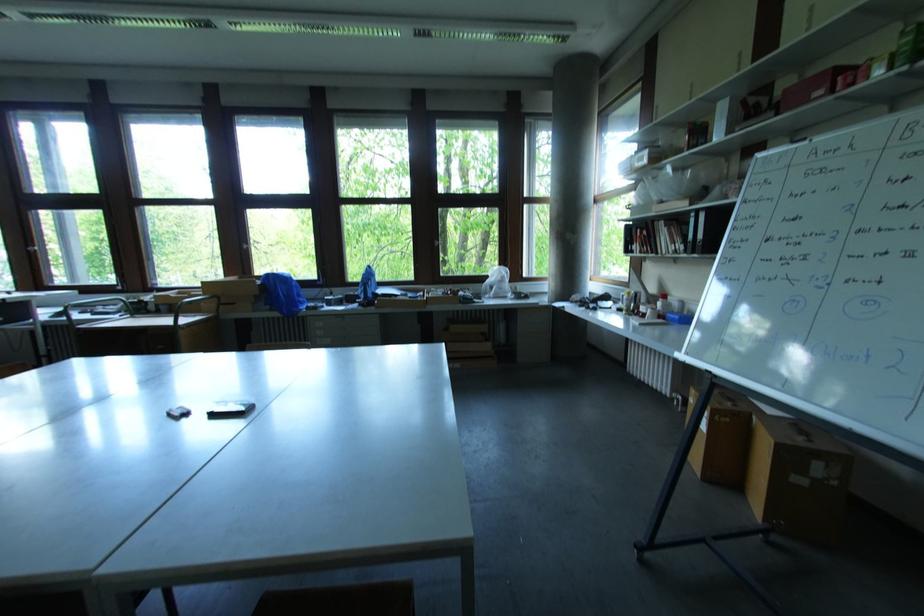
Where would you squeez the white spray bottle? Please return your answer as a coordinate pair (x, y).

(663, 304)